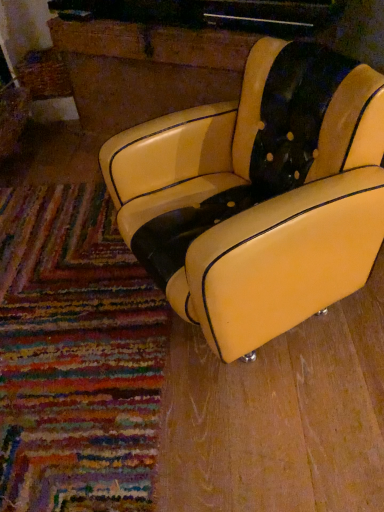
Image resolution: width=384 pixels, height=512 pixels. I want to click on free space in front of matte yellow leather chair at center, so click(285, 425).